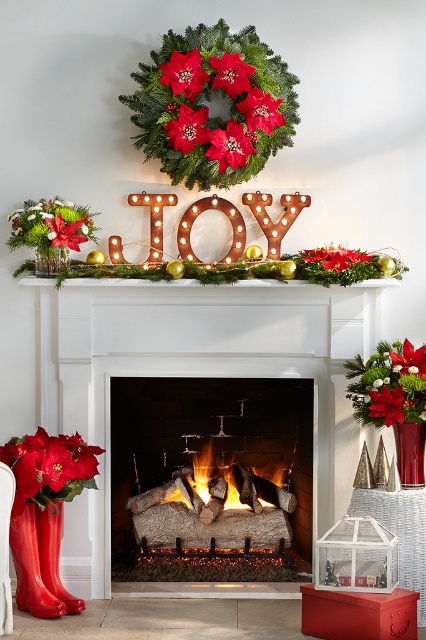
Does red velvet poinsettia at lower left appear over charcoal wood fire at center?

Yes.

Which of these two, red velvet poinsettia at lower left or charcoal wood fire at center, stands taller?

With more height is red velvet poinsettia at lower left.

Is point (29, 440) in front of point (273, 483)?

Yes, it is in front of point (273, 483).

Where is `red velvet poinsettia at lower left`? The image size is (426, 640). red velvet poinsettia at lower left is located at coordinates (48, 467).

Which is above, wooden logs at center or green matte wreath at upper center?

Positioned higher is green matte wreath at upper center.

Between point (244, 465) and point (155, 61), which one is positioned behind?

Positioned behind is point (244, 465).

Locate an element on the screen. The height and width of the screenshot is (640, 426). wooden logs at center is located at coordinates (209, 474).

Is green matte wreath at upper center smaller than glossy rubber boots at lower left?

Yes.

Between green matte wreath at upper center and glossy rubber boots at lower left, which one has more height?

glossy rubber boots at lower left

This screenshot has width=426, height=640. I want to click on green matte wreath at upper center, so click(210, 102).